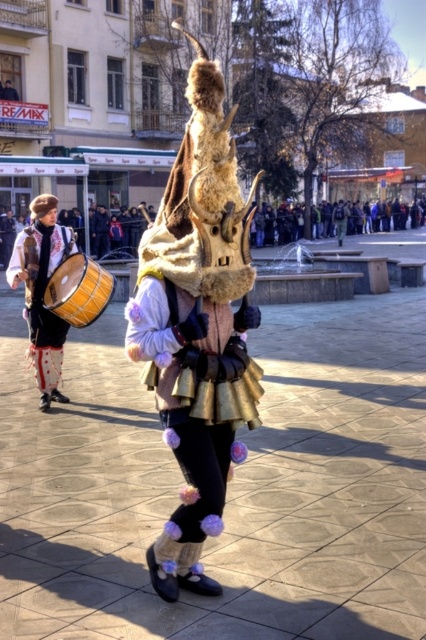
Question: Does matte brown drum at left have a lesser width compared to wooden drum at center?

Choices:
 (A) yes
 (B) no

Answer: (B)

Question: Is matte brown drum at left bigger than wooden drum at center?

Choices:
 (A) no
 (B) yes

Answer: (B)

Question: Is matte brown drum at left to the right of wooden drum at center from the viewer's perspective?

Choices:
 (A) yes
 (B) no

Answer: (B)